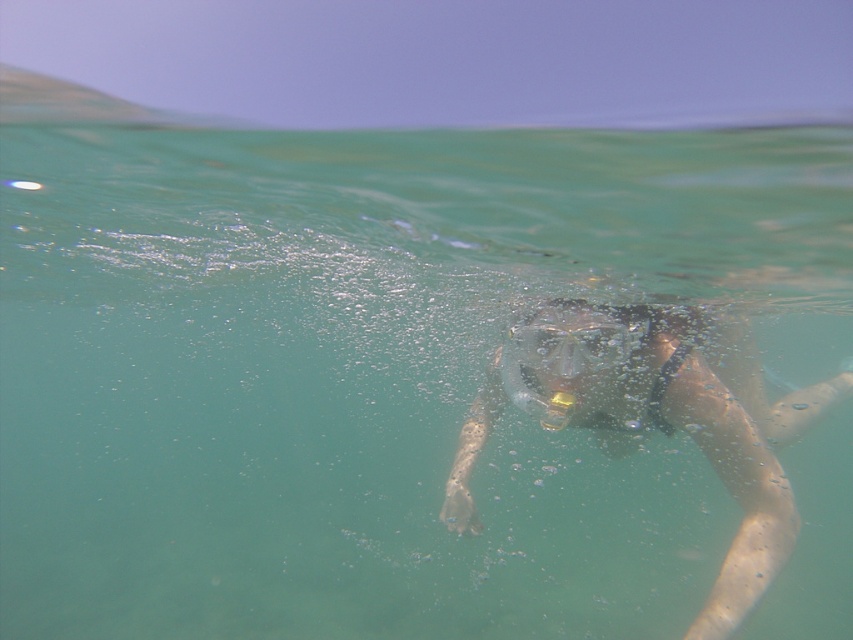
You are a marine biologist observing the underwater scene. You need to locate the transparent plastic snorkel mask at center. According to the coordinates provided, where exactly is it positioned in the image?

The transparent plastic snorkel mask at center is located at point [657,419] in the image.

You are a snorkeler preparing to dive underwater. You have two items in your hand, the transparent plastic snorkel mask at center and the transparent plastic goggles at center. Which item should you put on first to ensure proper fitment, considering their sizes?

The transparent plastic snorkel mask at center should be put on first because its width is larger than the transparent plastic goggles at center, ensuring it fits properly before adjusting the smaller goggles.